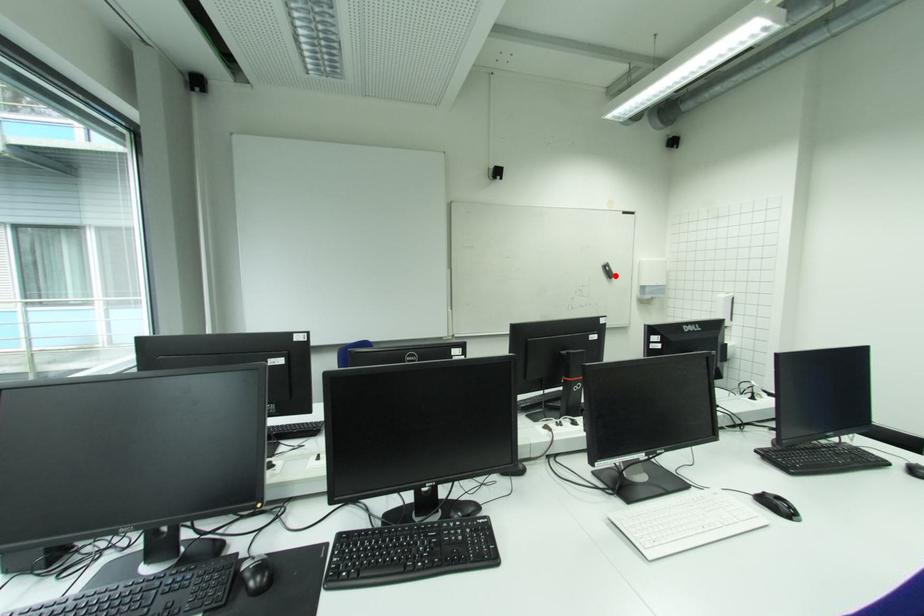
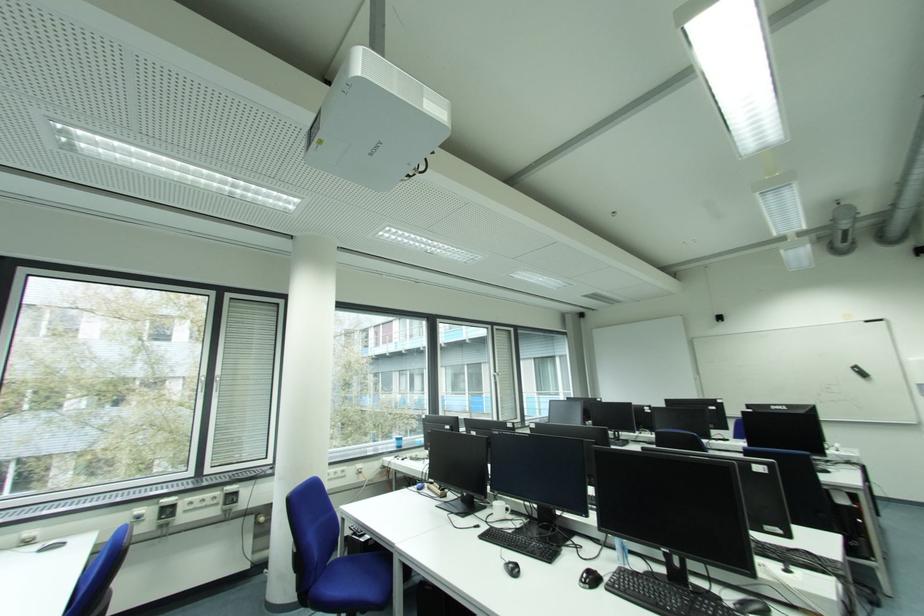
Question: I am providing you with two images of the same scene from different viewpoints. A red point is shown in image1. For the corresponding object point in image2, is it positioned nearer or farther from the camera?

Choices:
 (A) Nearer
 (B) Farther

Answer: (A)